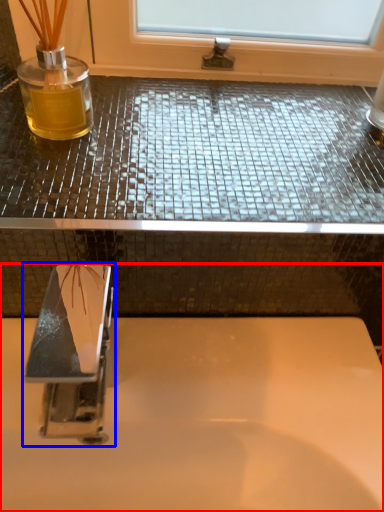
Question: Which of the following is the farthest to the observer, sink (highlighted by a red box) or tap (highlighted by a blue box)?

Choices:
 (A) sink
 (B) tap

Answer: (A)